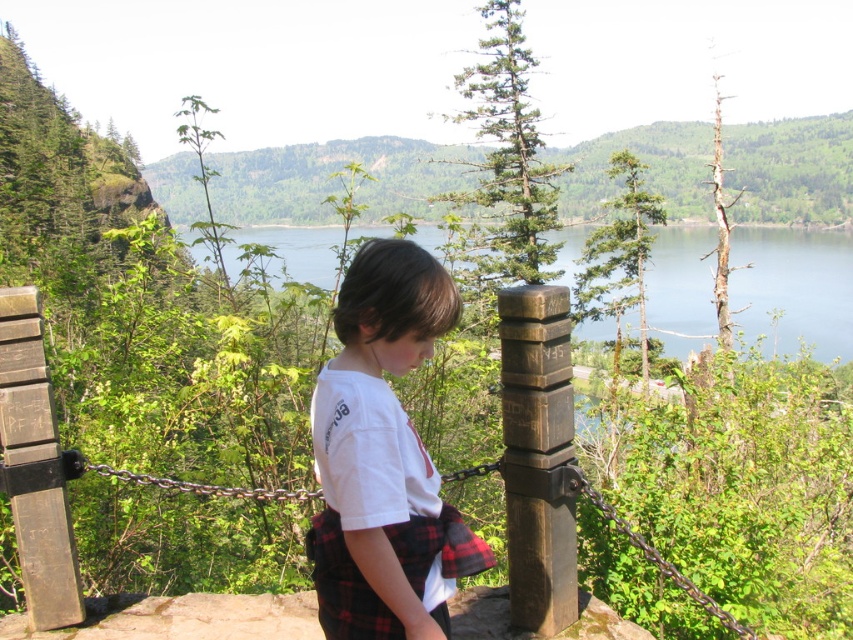
Where is the white cotton shirt at center located in the image?

The white cotton shirt at center is located at point 0.717 on the x axis and 0.451 on the y axis.

You are a photographer trying to capture the child in the white cotton shirt at center. Since the brown wood post at center is in the way, can you adjust your position to avoid it while still framing the child?

The white cotton shirt at center is positioned over the brown wood post at center, so moving your position slightly to the side would allow you to frame the child without the post blocking the view.